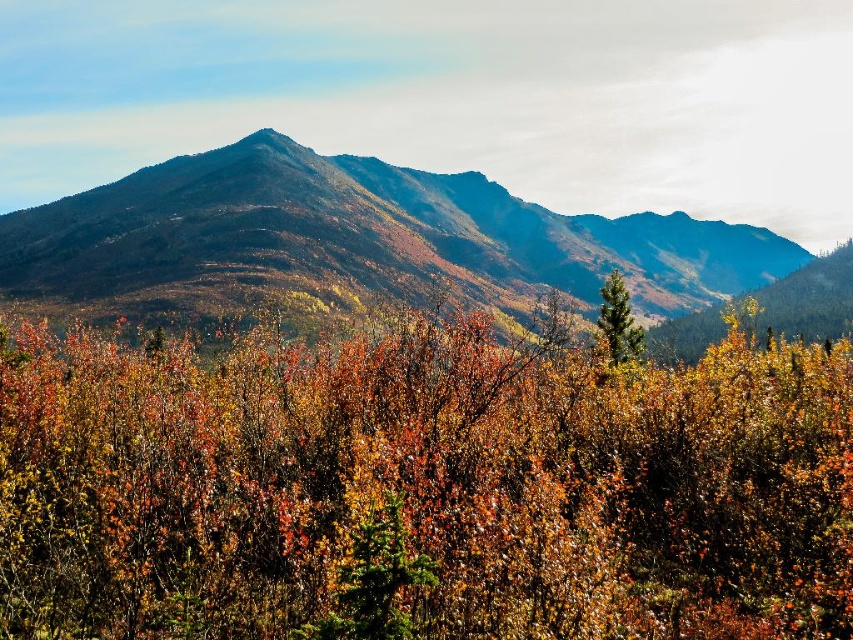
Between multicolored foliage at center and smooth brown mountain range at center, which one is positioned higher?

smooth brown mountain range at center is higher up.

Where is `multicolored foliage at center`? The width and height of the screenshot is (853, 640). multicolored foliage at center is located at coordinates (421, 488).

This screenshot has width=853, height=640. I want to click on multicolored foliage at center, so click(421, 488).

Does smooth brown mountain range at center have a smaller size compared to green matte tree at center?

Incorrect, smooth brown mountain range at center is not smaller in size than green matte tree at center.

Is point (370, 200) positioned in front of point (633, 349)?

No, (370, 200) is further to viewer.

Which is in front, point (196, 164) or point (604, 307)?

Point (604, 307) is more forward.

The width and height of the screenshot is (853, 640). In order to click on smooth brown mountain range at center in this screenshot , I will do pos(375,234).

Can you confirm if multicolored foliage at center is taller than green matte tree at center?

No, multicolored foliage at center is not taller than green matte tree at center.

In the scene shown: Can you confirm if multicolored foliage at center is wider than green matte tree at center?

Yes.

Is point (509, 513) positioned behind point (625, 348)?

No, (509, 513) is in front of (625, 348).

Find the location of a particular element. This screenshot has width=853, height=640. multicolored foliage at center is located at coordinates (421, 488).